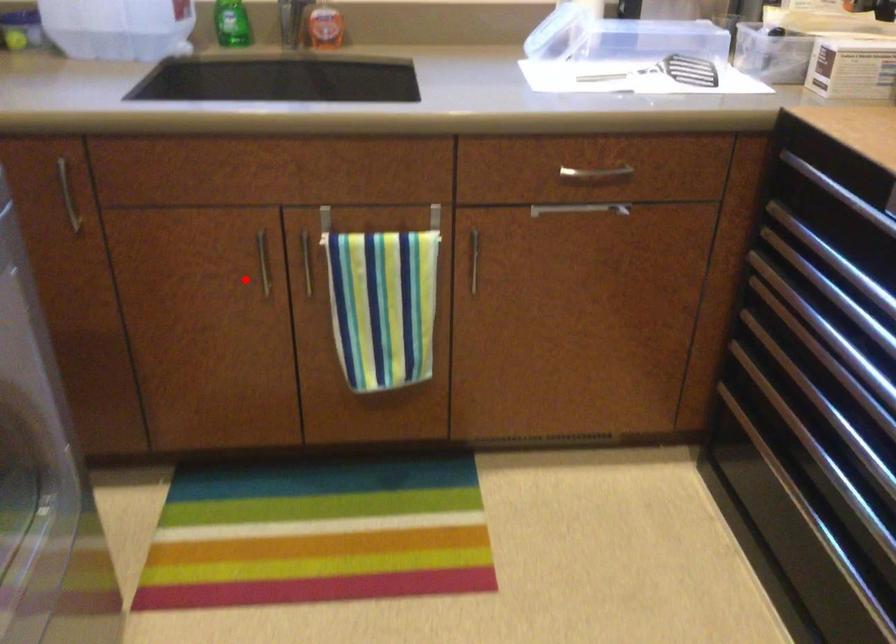
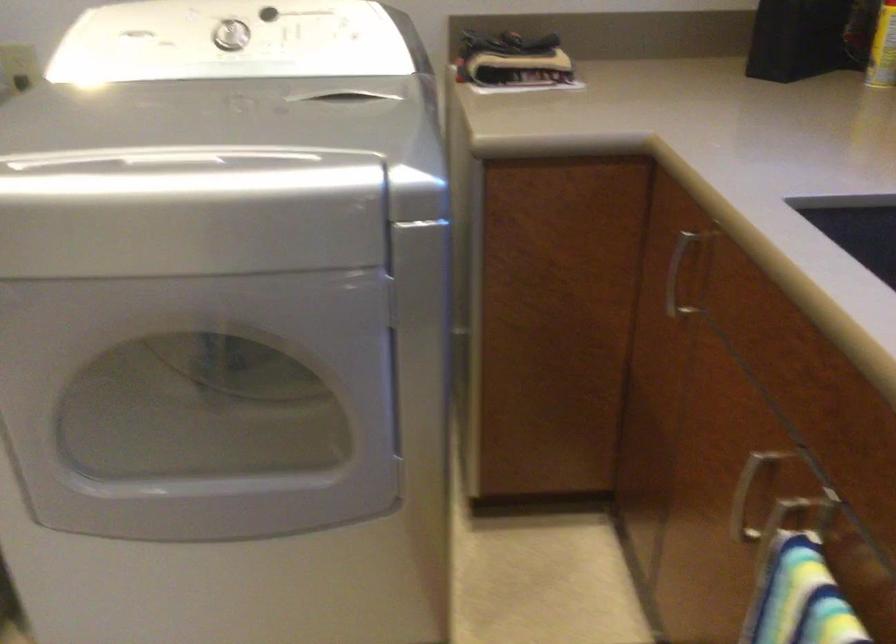
Locate, in the second image, the point that corresponds to the highlighted location in the first image.

(745, 497)